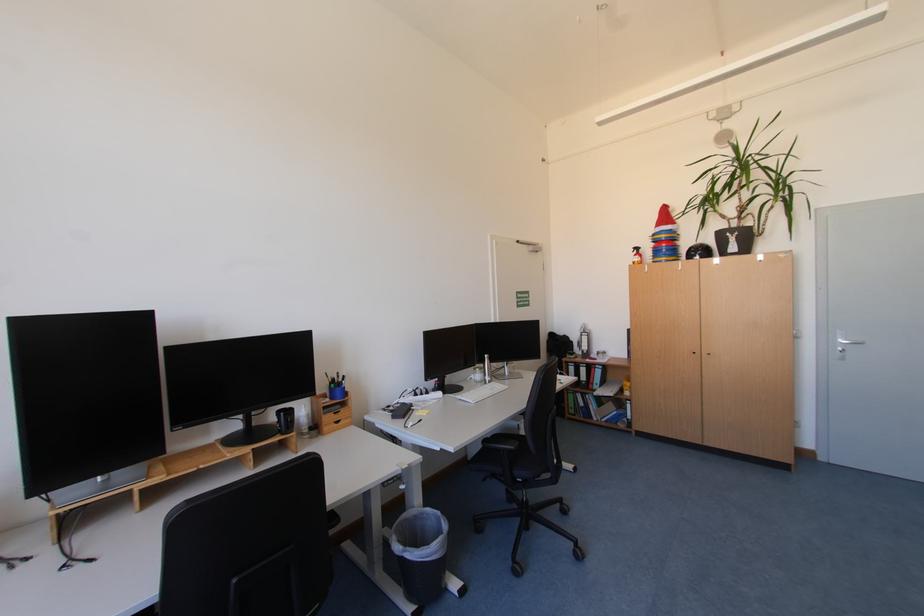
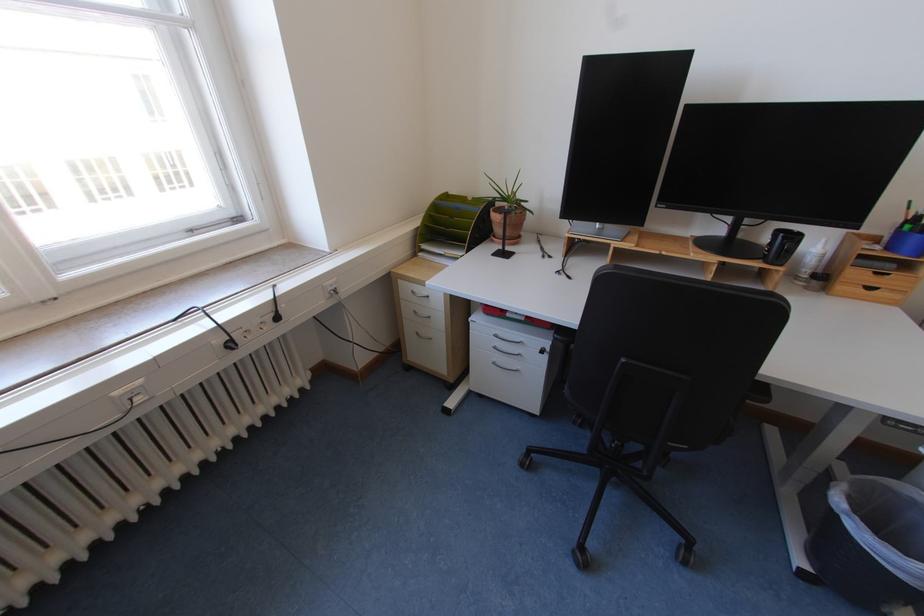
In the second image, find the point that corresponds to [314,428] in the first image.

(818, 273)